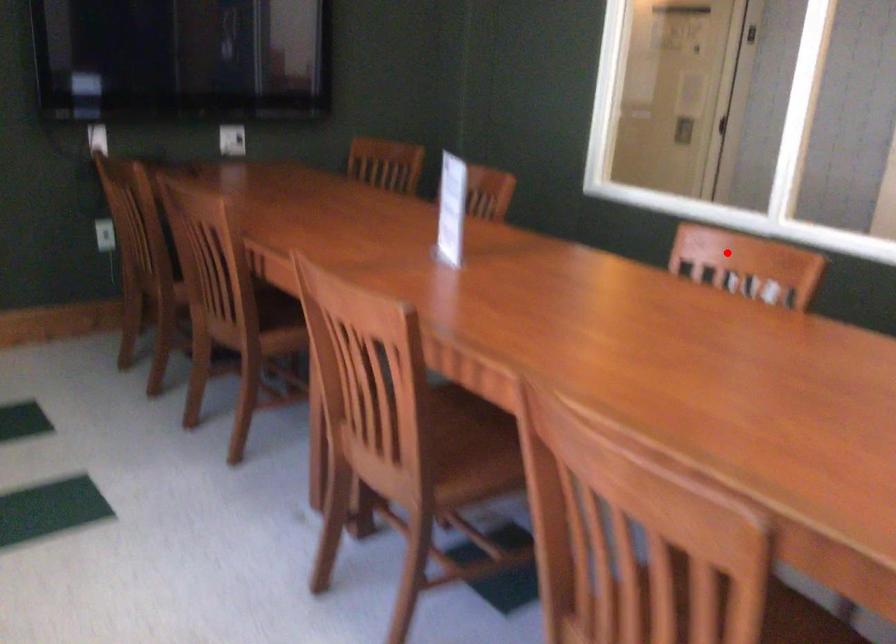
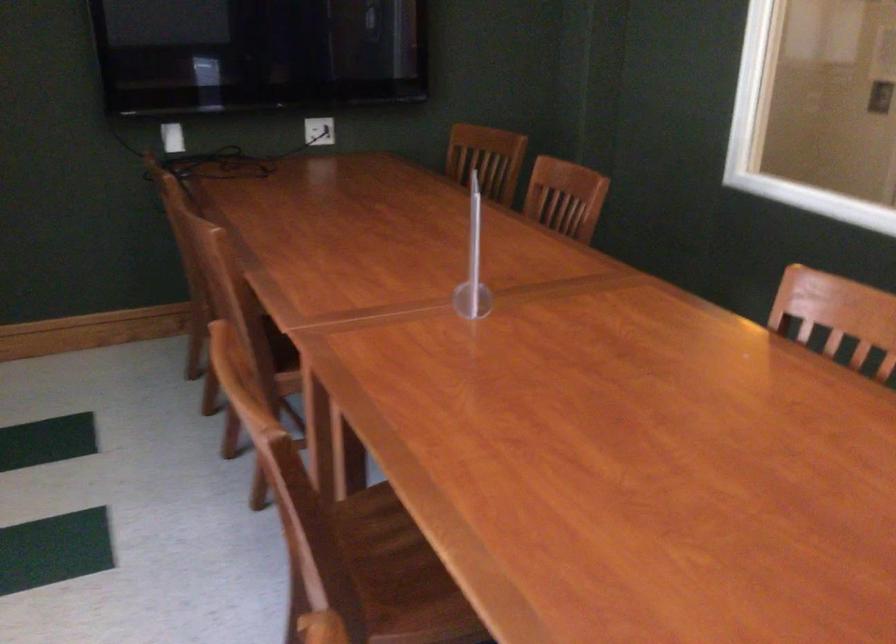
Where in the second image is the point corresponding to the highlighted location from the first image?

(841, 313)